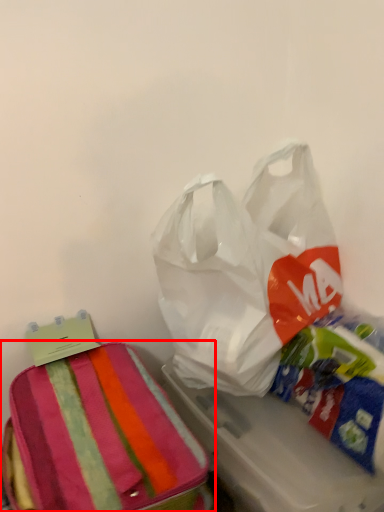
Question: Where is luggage and bags (annotated by the red box) located in relation to plastic bag in the image?

Choices:
 (A) right
 (B) left

Answer: (B)